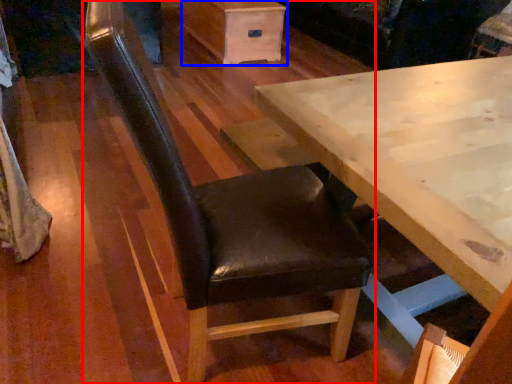
Question: Which object is closer to the camera taking this photo, chair (highlighted by a red box) or drawer (highlighted by a blue box)?

Choices:
 (A) chair
 (B) drawer

Answer: (A)